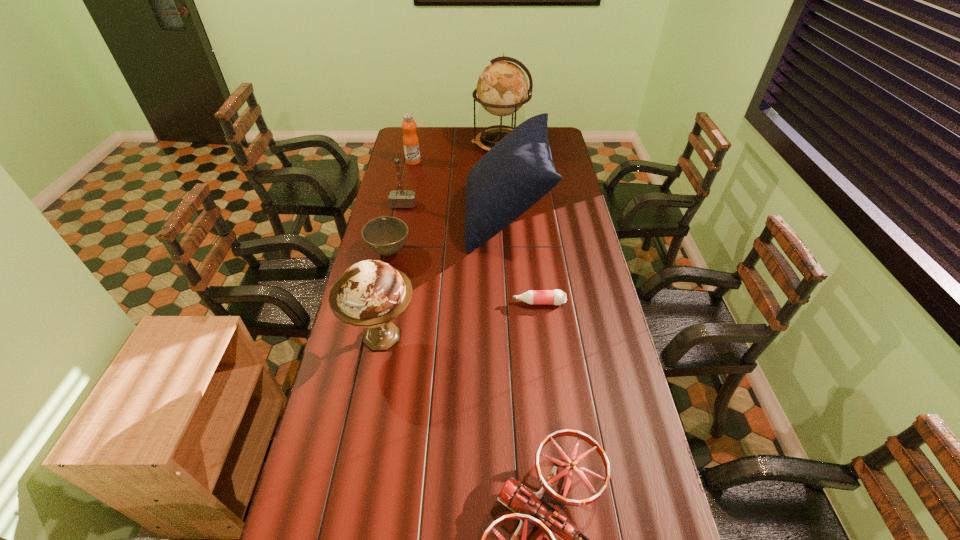
Locate an element on the screen. Image resolution: width=960 pixels, height=540 pixels. vacant point located at the center of the farther globe is located at coordinates (407, 145).

The width and height of the screenshot is (960, 540). I want to click on vacant space located 0.220m at the center of the farther globe, so click(431, 145).

Image resolution: width=960 pixels, height=540 pixels. What are the coordinates of `free location located at the center of the farther globe` in the screenshot? It's located at (455, 145).

In order to click on free region located on the facing side of the cushion in this screenshot , I will do `click(422, 217)`.

The image size is (960, 540). Identify the location of vacant point located on the facing side of the cushion. (377, 217).

At what (x,y) coordinates should I click in order to perform the action: click on vacant space situated 0.100m on the facing side of the cushion. Please return your answer as a coordinate pair (x, y). Looking at the image, I should click on (443, 217).

What are the coordinates of `vacant region located on the front of the second nearest object showing Asia` in the screenshot? It's located at (469, 338).

At what (x,y) coordinates should I click in order to perform the action: click on vacant space located 0.370m on the right of the fruit juice. Please return your answer as a coordinate pair (x, y). The height and width of the screenshot is (540, 960). Looking at the image, I should click on (492, 161).

Where is `free space located on the striking surface of the hammer`? Image resolution: width=960 pixels, height=540 pixels. free space located on the striking surface of the hammer is located at coordinates (393, 260).

Image resolution: width=960 pixels, height=540 pixels. I want to click on vacant space located 0.250m on the right of the bowl, so click(x=473, y=252).